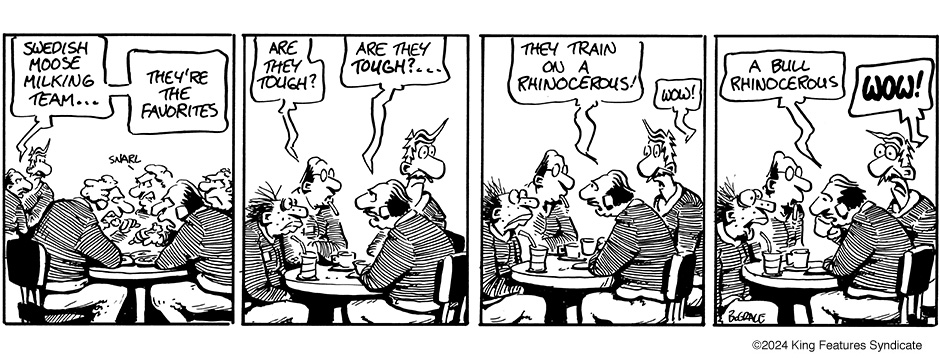
Identify the location of cup. (306, 265), (345, 259), (542, 257), (568, 251), (587, 247), (362, 267), (773, 262), (801, 258).